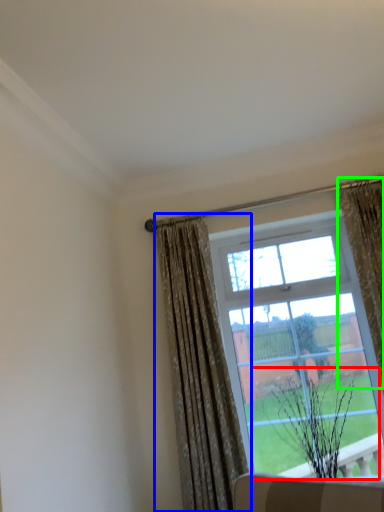
Question: Estimate the real-world distances between objects in this image. Which object is farther from plant (highlighted by a red box), curtain (highlighted by a blue box) or curtain (highlighted by a green box)?

Choices:
 (A) curtain
 (B) curtain

Answer: (B)